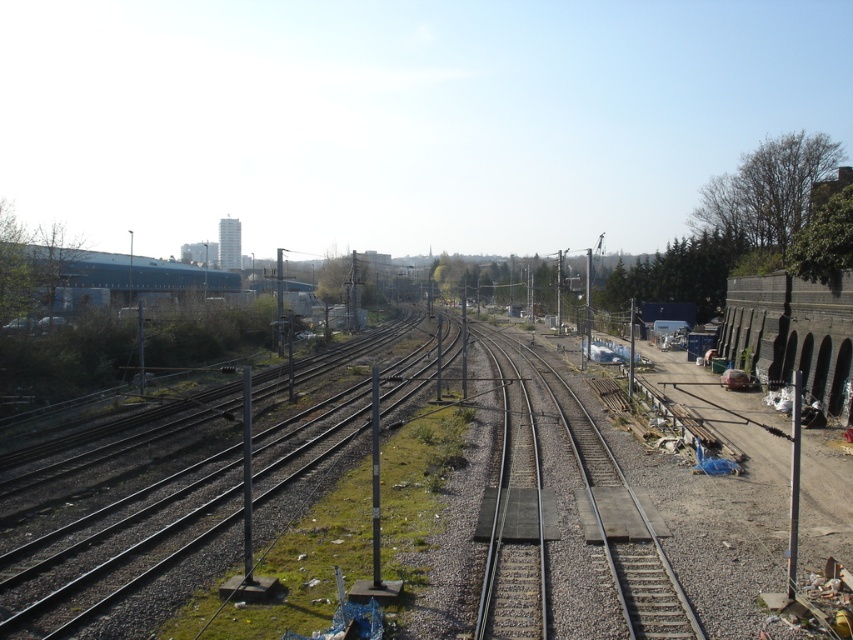
Question: Is smooth steel train track at center closer to camera compared to metallic gray train track at center?

Choices:
 (A) yes
 (B) no

Answer: (B)

Question: Does smooth steel train track at center have a smaller size compared to blue matte building at upper left?

Choices:
 (A) yes
 (B) no

Answer: (A)

Question: Which object is farther from the camera taking this photo?

Choices:
 (A) blue matte building at upper left
 (B) smooth steel train track at center

Answer: (A)

Question: Does smooth steel train track at center have a larger size compared to blue matte building at upper left?

Choices:
 (A) yes
 (B) no

Answer: (B)

Question: Estimate the real-world distances between objects in this image. Which object is closer to the metallic gray train track at center?

Choices:
 (A) smooth steel train track at center
 (B) blue matte building at upper left

Answer: (A)

Question: Which point is farther from the camera taking this photo?

Choices:
 (A) (50, 556)
 (B) (132, 268)
 (C) (483, 534)

Answer: (B)